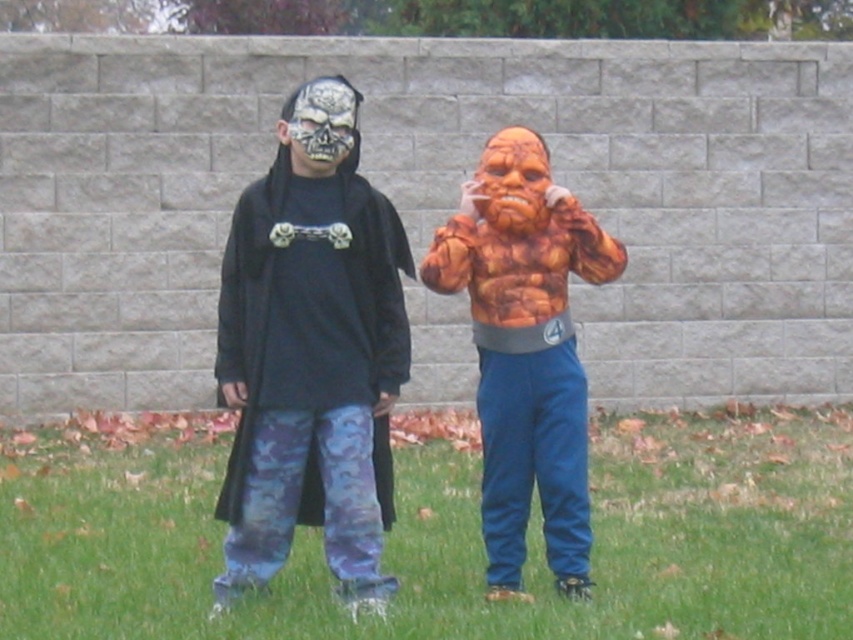
You are standing in front of the large light gray stone wall. You see two points marked in the image. Which point is closer to you, point (838, 486) or point (566, 292)?

Point (566, 292) is closer to you because it is less further to the camera than point (838, 486).

You are taking a photo of the two points in the image. Which point, point (x=10, y=509) or point (x=274, y=257), will appear larger in your photo?

Point (x=10, y=509) will appear larger in the photo because it is closer to the camera than point (x=274, y=257).

You are a photographer trying to capture a clear shot of the matte black costume at center without the green grass at lower center blocking it. How should you adjust your position?

Move your camera position lower to avoid the green grass at lower center blocking the matte black costume at center, as the matte black costume at center is behind the green grass at lower center.